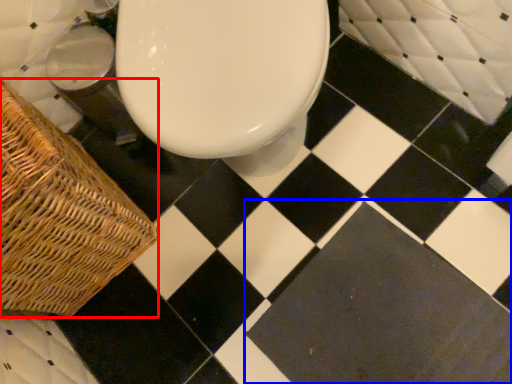
Question: Which object appears closest to the camera in this image, picnic basket (highlighted by a red box) or square (highlighted by a blue box)?

Choices:
 (A) picnic basket
 (B) square

Answer: (A)